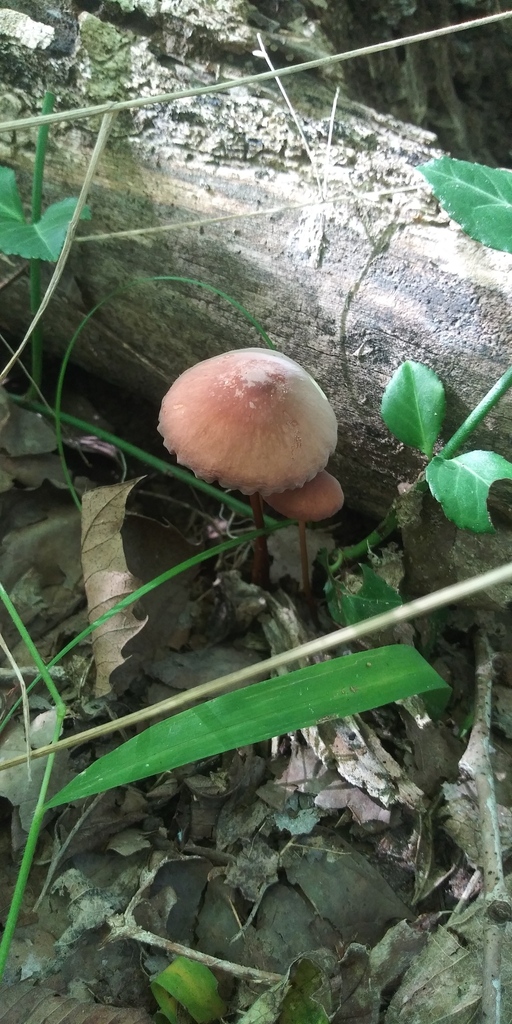
Locate an element on the screen. grain of wood is located at coordinates (232, 252).